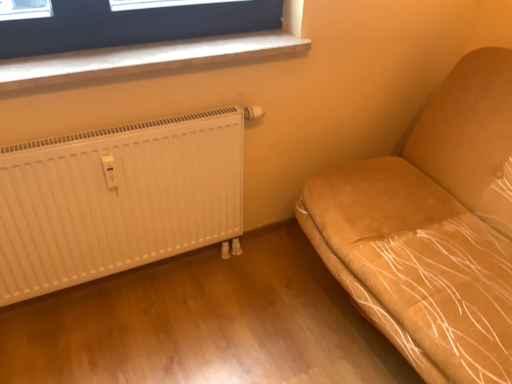
Identify the location of free space above white plastic window sill at upper left (from a real-world perspective). The height and width of the screenshot is (384, 512). (137, 50).